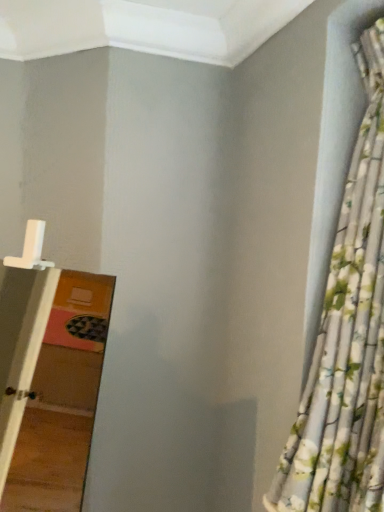
Question: Is floral fabric curtain at right to the left of white plastic ladder at left from the viewer's perspective?

Choices:
 (A) no
 (B) yes

Answer: (A)

Question: Is floral fabric curtain at right aimed at white plastic ladder at left?

Choices:
 (A) yes
 (B) no

Answer: (B)

Question: Is floral fabric curtain at right to the right of white plastic ladder at left from the viewer's perspective?

Choices:
 (A) yes
 (B) no

Answer: (A)

Question: From a real-world perspective, does floral fabric curtain at right stand above white plastic ladder at left?

Choices:
 (A) yes
 (B) no

Answer: (A)

Question: From the image's perspective, is floral fabric curtain at right located beneath white plastic ladder at left?

Choices:
 (A) no
 (B) yes

Answer: (A)

Question: Is floral fabric curtain at right directly adjacent to white plastic ladder at left?

Choices:
 (A) no
 (B) yes

Answer: (A)

Question: From the image's perspective, would you say white plastic ladder at left is positioned over floral fabric curtain at right?

Choices:
 (A) no
 (B) yes

Answer: (A)

Question: Does white plastic ladder at left have a greater height compared to floral fabric curtain at right?

Choices:
 (A) no
 (B) yes

Answer: (A)

Question: Does white plastic ladder at left have a larger size compared to floral fabric curtain at right?

Choices:
 (A) yes
 (B) no

Answer: (A)

Question: Is white plastic ladder at left smaller than floral fabric curtain at right?

Choices:
 (A) yes
 (B) no

Answer: (B)

Question: Would you say white plastic ladder at left is outside floral fabric curtain at right?

Choices:
 (A) yes
 (B) no

Answer: (A)

Question: Can you confirm if white plastic ladder at left is wider than floral fabric curtain at right?

Choices:
 (A) yes
 (B) no

Answer: (A)

Question: In terms of height, does floral fabric curtain at right look taller or shorter compared to white plastic ladder at left?

Choices:
 (A) short
 (B) tall

Answer: (B)